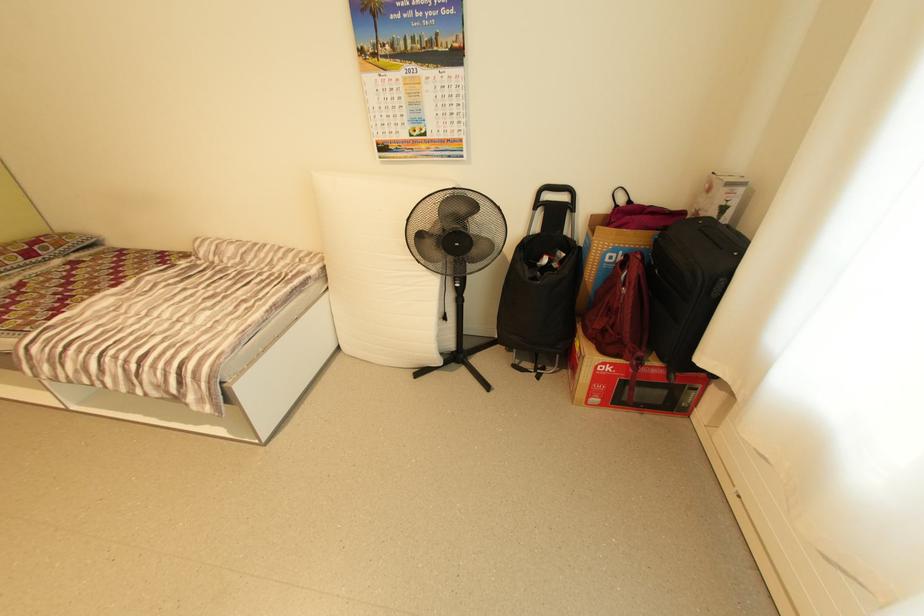
Where is `fan control knob`? fan control knob is located at coordinates (458, 283).